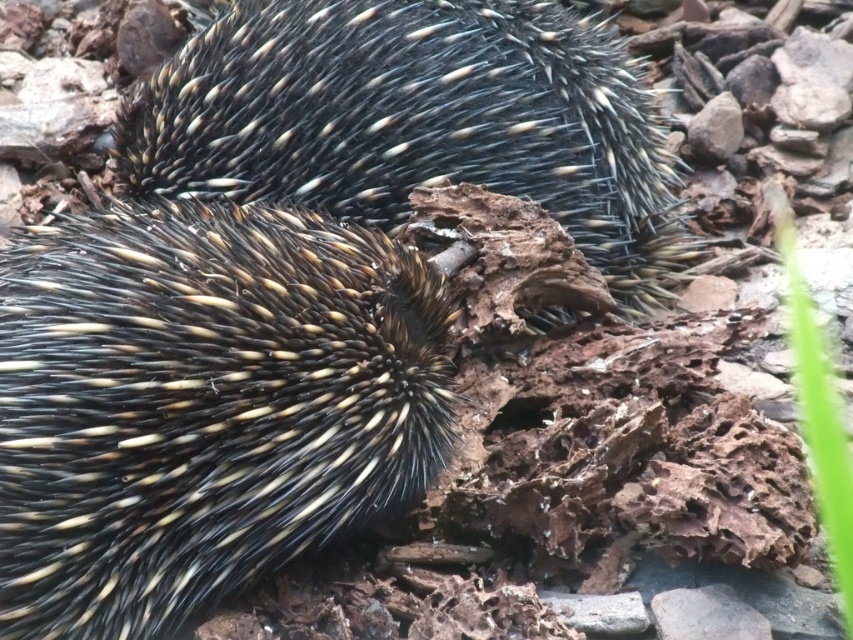
Does point (337, 317) come farther from viewer compared to point (409, 161)?

That is False.

From the picture: Who is positioned more to the left, black spiny hedgehog at center or spiny black hedgehog at center?

From the viewer's perspective, black spiny hedgehog at center appears more on the left side.

Is point (19, 618) closer to viewer compared to point (399, 45)?

Yes, it is in front of point (399, 45).

Find the location of `black spiny hedgehog at center`. black spiny hedgehog at center is located at coordinates (202, 404).